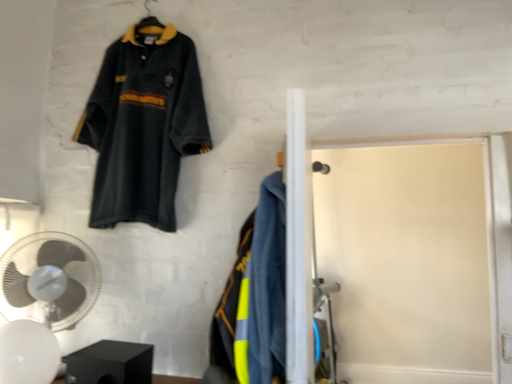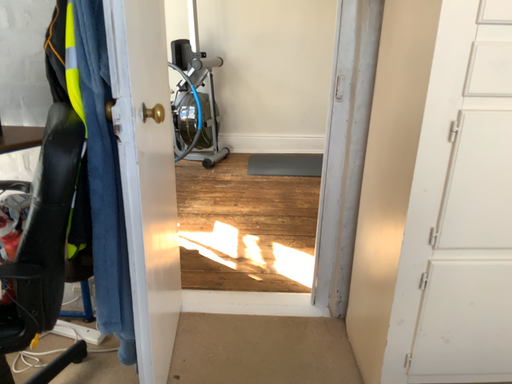
Question: How did the camera likely rotate when shooting the video?

Choices:
 (A) rotated left
 (B) rotated right

Answer: (B)